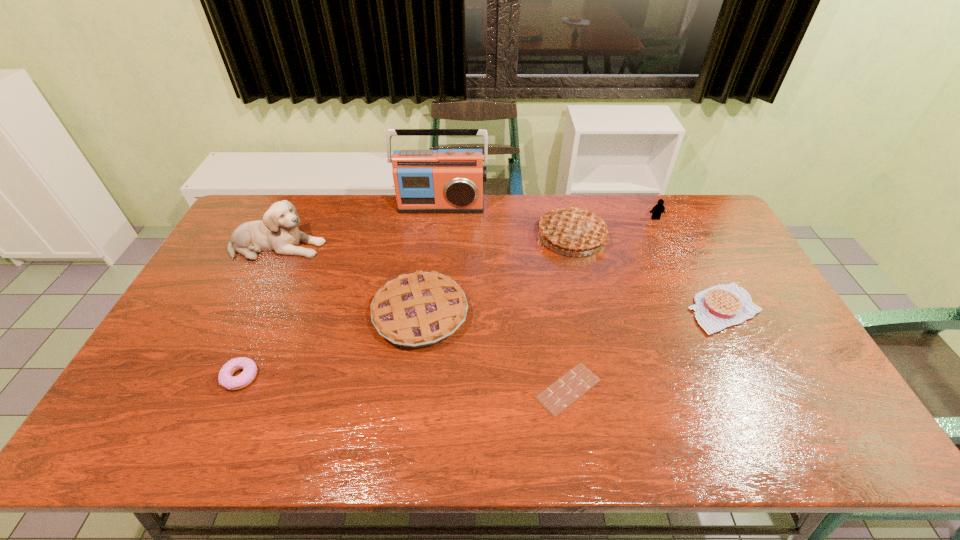
This screenshot has width=960, height=540. What are the coordinates of `free space located on the front-facing side of the tallest object` in the screenshot? It's located at (433, 286).

Where is `vacant area located 0.320m on the front of the tallest pie`? This screenshot has height=540, width=960. vacant area located 0.320m on the front of the tallest pie is located at coordinates (595, 339).

At what (x,y) coordinates should I click in order to perform the action: click on vacant area situated on the front-facing side of the puppy. Please return your answer as a coordinate pair (x, y). This screenshot has width=960, height=540. Looking at the image, I should click on (388, 246).

You are a GUI agent. You are given a task and a screenshot of the screen. Output one action in this format:
    pyautogui.click(x=<x>, y=<y>)
    Task: Click on the free space located 0.290m on the face of the fourth tallest object
    This screenshot has width=960, height=540.
    Given the screenshot: What is the action you would take?
    pyautogui.click(x=683, y=276)

You are a GUI agent. You are given a task and a screenshot of the screen. Output one action in this format:
    pyautogui.click(x=<x>, y=<y>)
    Task: Click on the free region located on the back of the second shortest pie
    The image size is (960, 540).
    Given the screenshot: What is the action you would take?
    pyautogui.click(x=434, y=210)

Where is `vacant space located 0.050m on the left of the shortest pie`? The image size is (960, 540). vacant space located 0.050m on the left of the shortest pie is located at coordinates (670, 309).

Where is `free spot located 0.400m on the right of the doughnut`? The height and width of the screenshot is (540, 960). free spot located 0.400m on the right of the doughnut is located at coordinates (414, 377).

I want to click on free spot located 0.220m on the back of the shortest object, so click(x=554, y=300).

You are a GUI agent. You are given a task and a screenshot of the screen. Output one action in this format:
    pyautogui.click(x=<x>, y=<y>)
    Task: Click on the radio receiver that is at the far edge
    Image resolution: width=960 pixels, height=540 pixels.
    Given the screenshot: What is the action you would take?
    pyautogui.click(x=445, y=180)

What are the coordinates of `pie located in the far edge section of the desktop` in the screenshot? It's located at (574, 229).